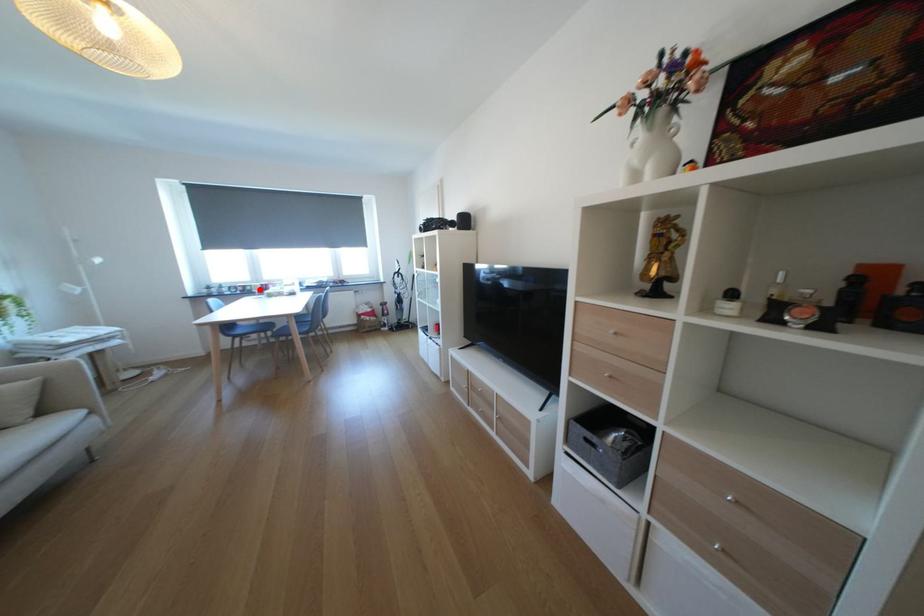
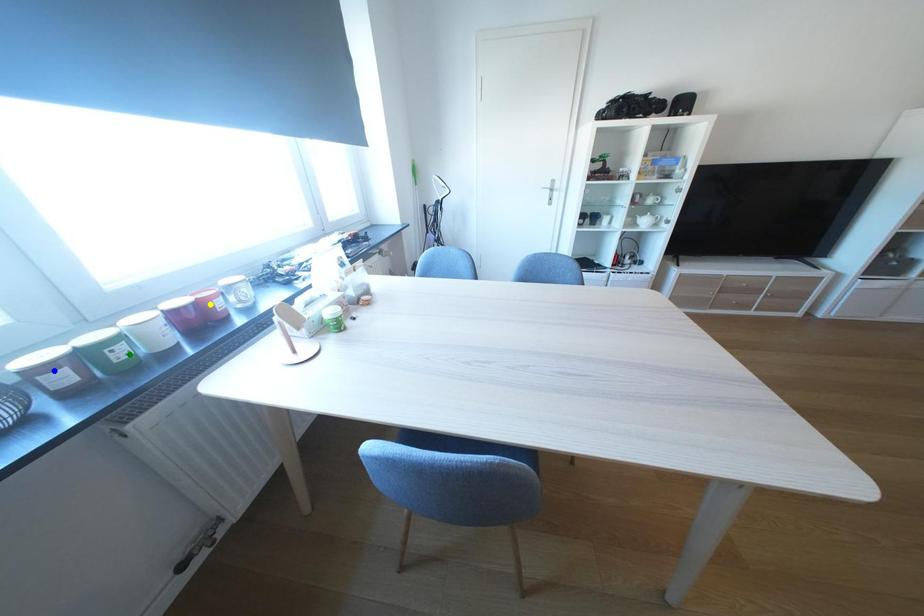
Question: I am providing you with two images of the same scene from different viewpoints. A red point is marked on the first image. You are given multiple points on the second image. Which mark in image 2 goes with the point in image 1?

Choices:
 (A) blue point
 (B) green point
 (C) yellow point

Answer: (B)